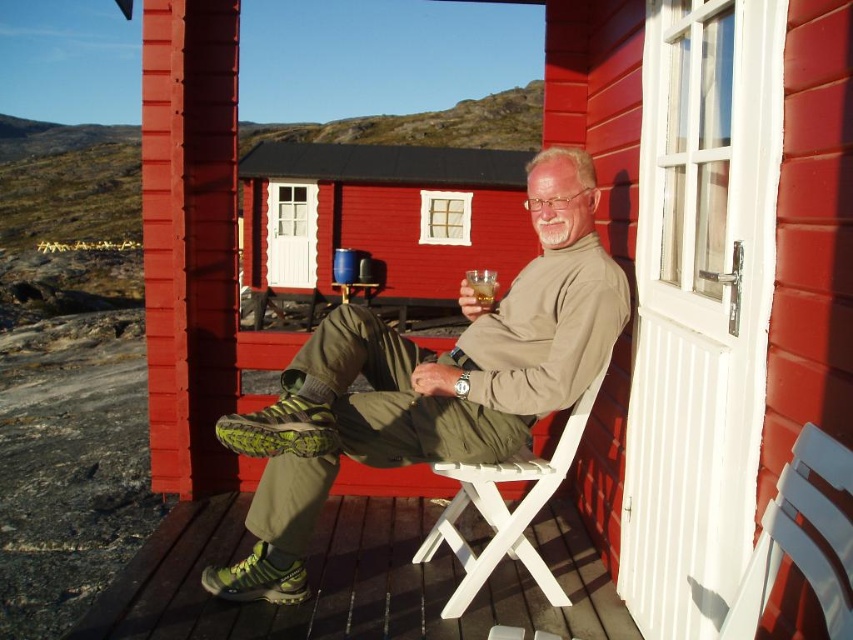
Question: Is brown wooden porch at lower left smaller than white plastic chair at center?

Choices:
 (A) no
 (B) yes

Answer: (B)

Question: Which object is farther from the camera taking this photo?

Choices:
 (A) white plastic chair at center
 (B) red wooden cabin at center
 (C) brown wooden porch at lower left

Answer: (B)

Question: Is white plastic chair at center further to camera compared to translucent glass at center?

Choices:
 (A) no
 (B) yes

Answer: (A)

Question: Can you confirm if white plastic chair at lower right is positioned to the right of translucent glass at center?

Choices:
 (A) yes
 (B) no

Answer: (A)

Question: Which point is farther from the camera taking this photo?

Choices:
 (A) (490, 301)
 (B) (531, 308)
 (C) (451, 154)

Answer: (C)

Question: Which point appears closest to the camera in this image?

Choices:
 (A) (479, 282)
 (B) (801, 438)

Answer: (B)